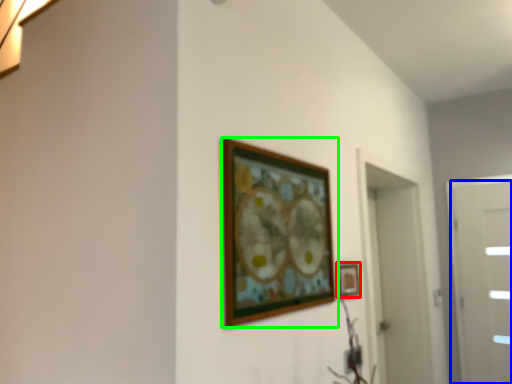
Question: Which object is positioned closest to picture frame (highlighted by a red box)? Select from door (highlighted by a blue box) and picture frame (highlighted by a green box).

Choices:
 (A) door
 (B) picture frame

Answer: (B)